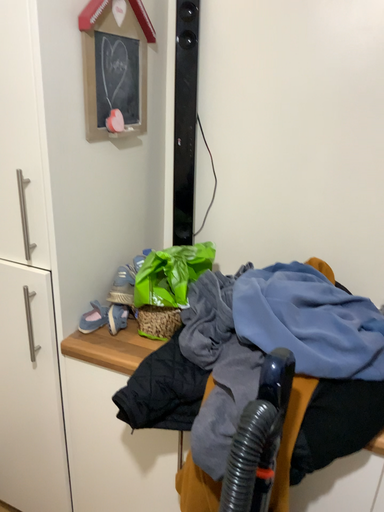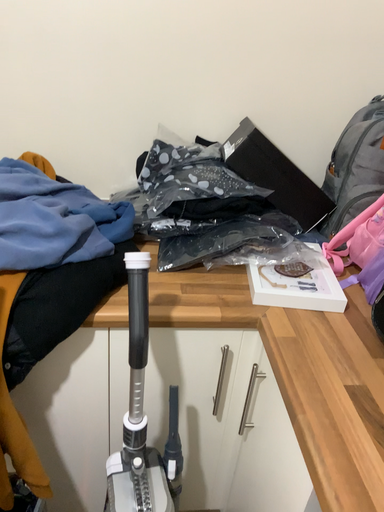
Question: How did the camera likely rotate when shooting the video?

Choices:
 (A) rotated right
 (B) rotated left

Answer: (A)